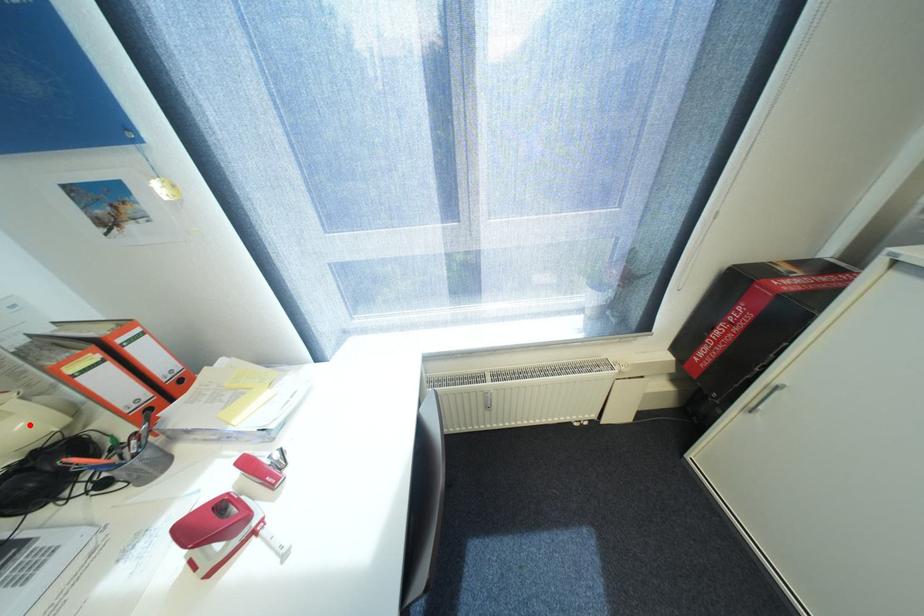
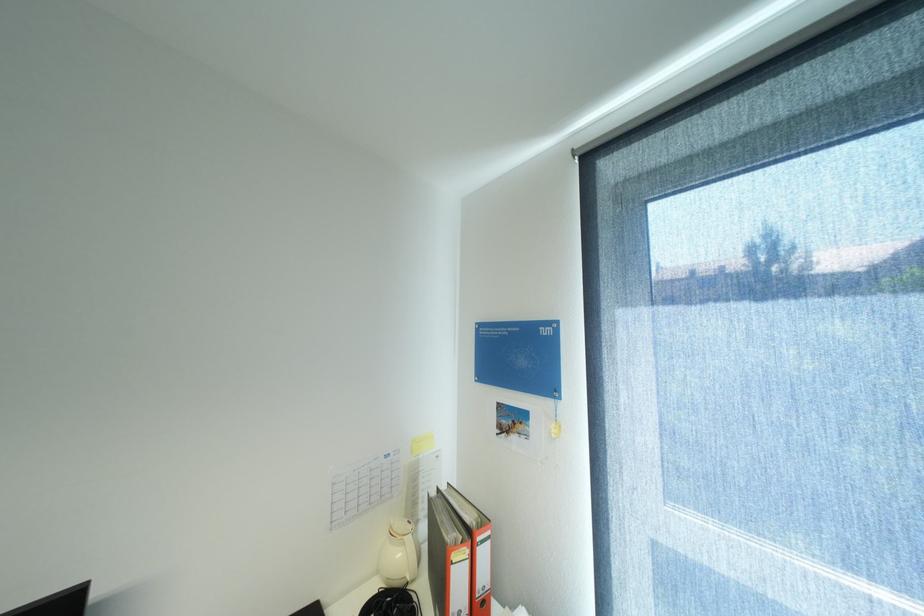
Find the pixel in the second image that matches the highlighted location in the first image.

(407, 554)